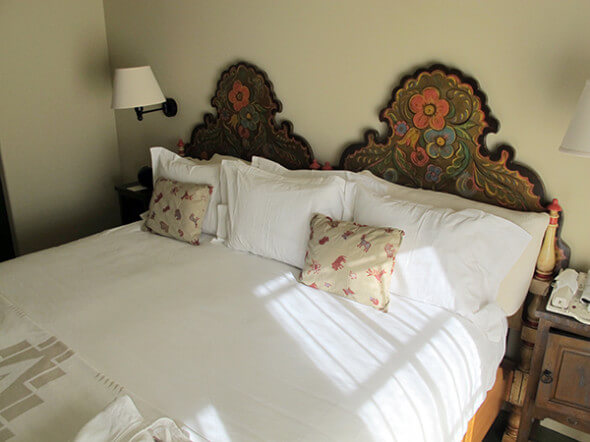
Find the location of a particular element. This screenshot has height=442, width=590. sunlight shining through window is located at coordinates pos(348,353), pos(363,335), pos(395,327).